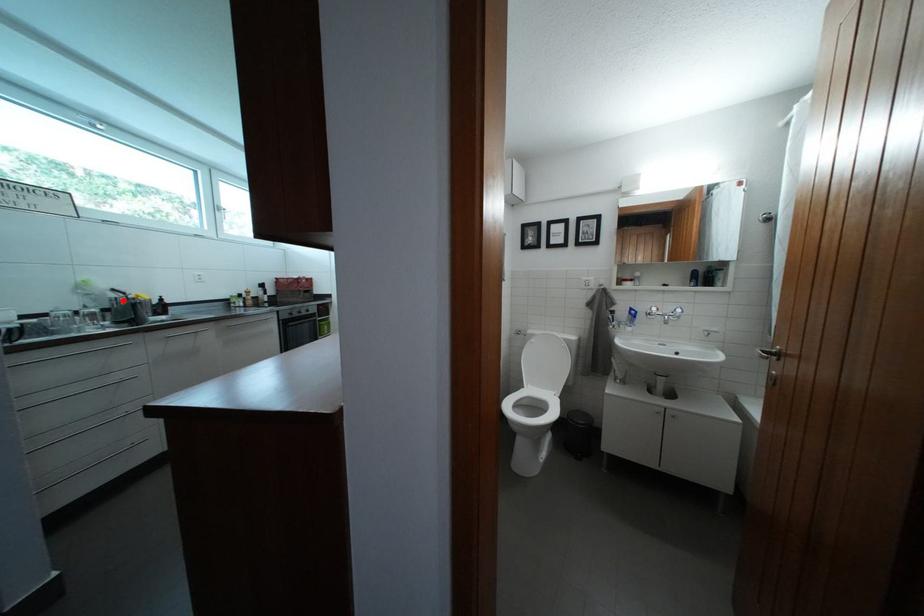
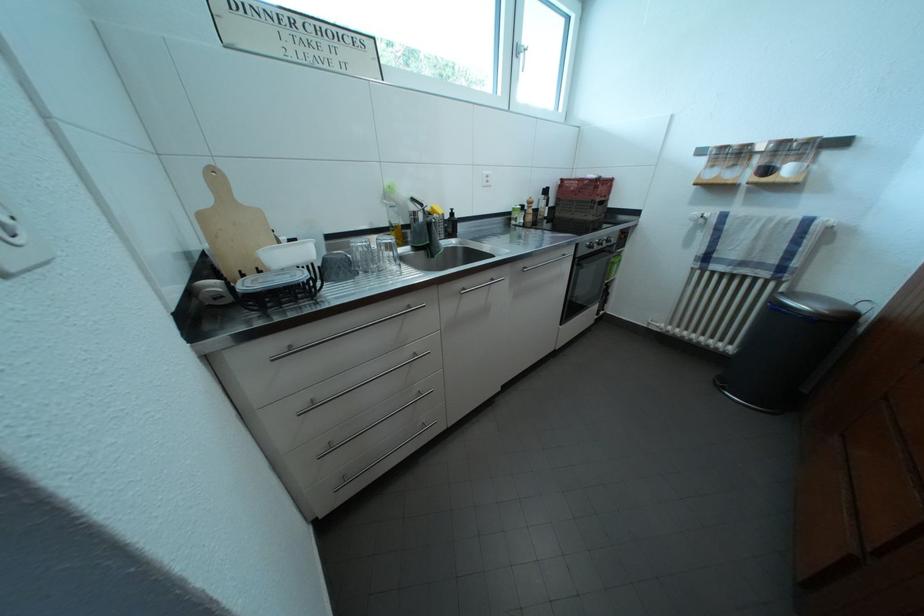
In the second image, find the point that corresponds to the highlighted location in the first image.

(421, 213)